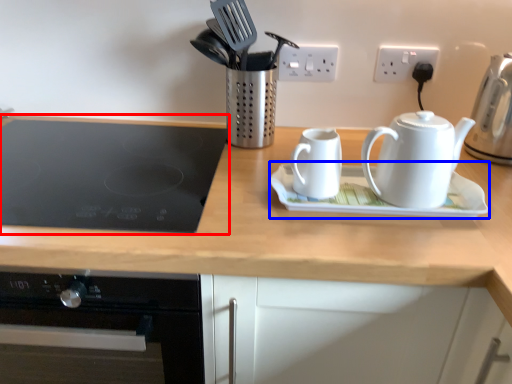
Question: Which object is further to the camera taking this photo, gas stove (highlighted by a red box) or saucer (highlighted by a blue box)?

Choices:
 (A) gas stove
 (B) saucer

Answer: (B)